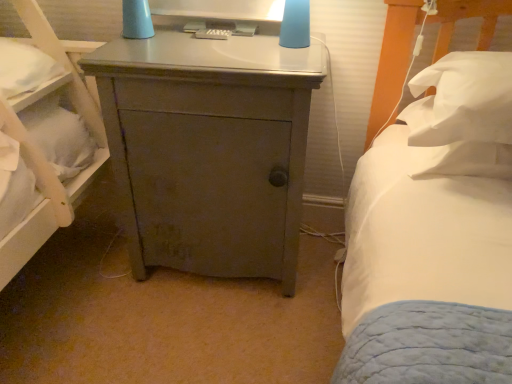
Image resolution: width=512 pixels, height=384 pixels. In order to click on vacant area that is in front of matte plastic remote control at upper center in this screenshot , I will do `click(206, 51)`.